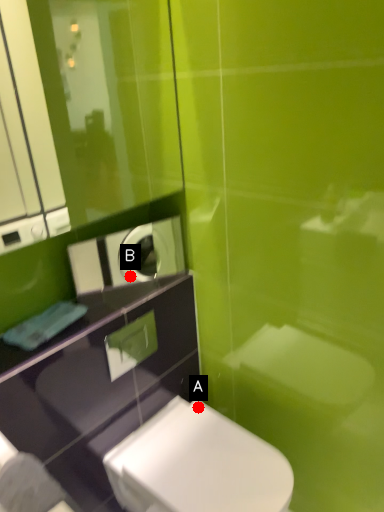
Question: Two points are circled on the image, labeled by A and B beside each circle. Which point is closer to the camera?

Choices:
 (A) A is closer
 (B) B is closer

Answer: (A)